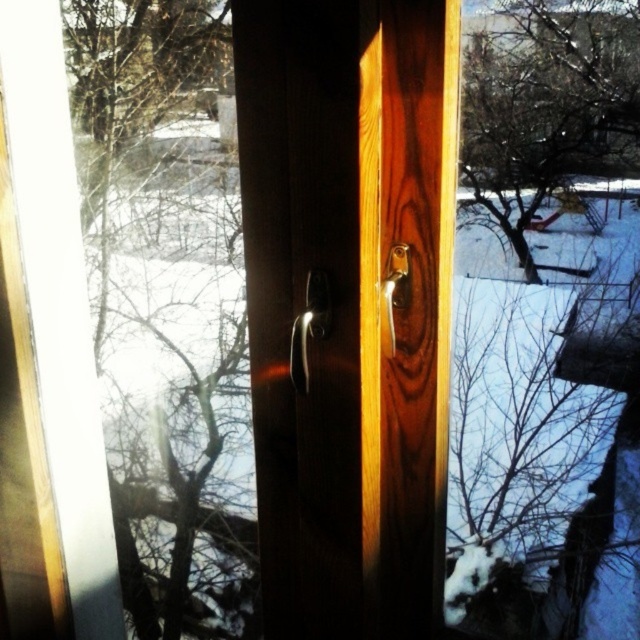
You are standing in front of the wooden door with a window frame. You notice two points marked on the door. One is at point coordinates point (308, 317) and the other is at point coordinates point (381, 339). Which point is closer to you?

Point (308, 317) is in front of point (381, 339), so it is closer to you.

You are standing in front of a wooden door with two handles. You need to open the door by pulling the lower handle. Which handle should you pull? The satin wood door handle at center or the polished brass door handle at center?

The satin wood door handle at center is below the polished brass door handle at center, so you should pull the satin wood door handle at center to open the door.